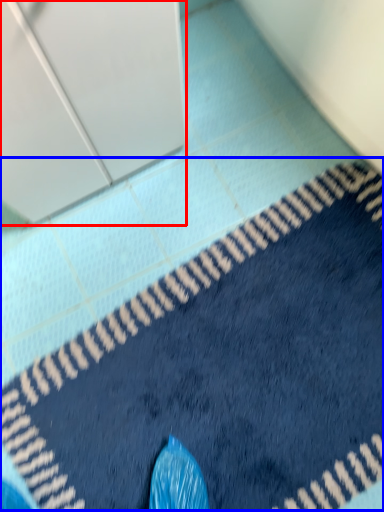
Question: Which object appears closest to the camera in this image, screen door (highlighted by a red box) or bath mat (highlighted by a blue box)?

Choices:
 (A) screen door
 (B) bath mat

Answer: (A)